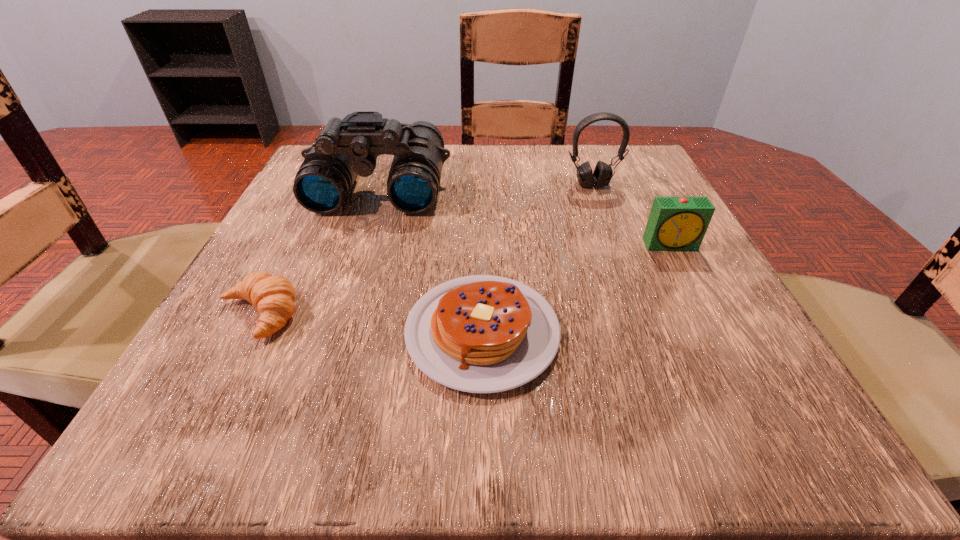
At what (x,y) coordinates should I click in order to perform the action: click on free space located on the right of the pancake. Please return your answer as a coordinate pair (x, y). Looking at the image, I should click on (737, 332).

Where is `binoculars present at the far edge`? binoculars present at the far edge is located at coordinates (347, 147).

The image size is (960, 540). I want to click on headset located in the far edge section of the desktop, so click(602, 174).

Locate an element on the screen. This screenshot has width=960, height=540. object present at the near edge is located at coordinates (480, 334).

Identify the location of binoculars situated at the left edge. (347, 147).

At what (x,y) coordinates should I click in order to perform the action: click on crescent roll that is at the left edge. Please return your answer as a coordinate pair (x, y). This screenshot has width=960, height=540. Looking at the image, I should click on (274, 296).

What are the coordinates of `headset that is positioned at the right edge` in the screenshot? It's located at (602, 174).

The height and width of the screenshot is (540, 960). What are the coordinates of `alarm clock located in the right edge section of the desktop` in the screenshot? It's located at (675, 223).

What are the coordinates of `object situated at the far left corner` in the screenshot? It's located at (347, 147).

Image resolution: width=960 pixels, height=540 pixels. I want to click on object that is at the far right corner, so click(602, 174).